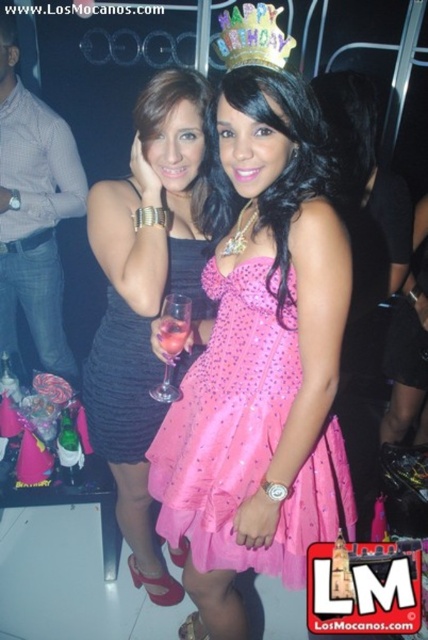
Who is positioned more to the left, black satin dress at center or gold glittery crown at upper center?

Positioned to the left is black satin dress at center.

Who is more distant from viewer, (152, 420) or (225, 58)?

Point (152, 420)

The height and width of the screenshot is (640, 428). Describe the element at coordinates (121, 385) in the screenshot. I see `black satin dress at center` at that location.

The height and width of the screenshot is (640, 428). In order to click on black satin dress at center in this screenshot , I will do `click(121, 385)`.

Image resolution: width=428 pixels, height=640 pixels. In order to click on pink satin dress at center in this screenshot , I will do `click(246, 435)`.

Does pink satin dress at center have a larger size compared to gold glittery crown at upper center?

Yes.

Is pink satin dress at center to the right of gold glittery crown at upper center from the viewer's perspective?

No, pink satin dress at center is not to the right of gold glittery crown at upper center.

Which is in front, point (199, 445) or point (267, 38)?

Point (267, 38) is in front.

Find the location of a particular element. The height and width of the screenshot is (640, 428). pink satin dress at center is located at coordinates [246, 435].